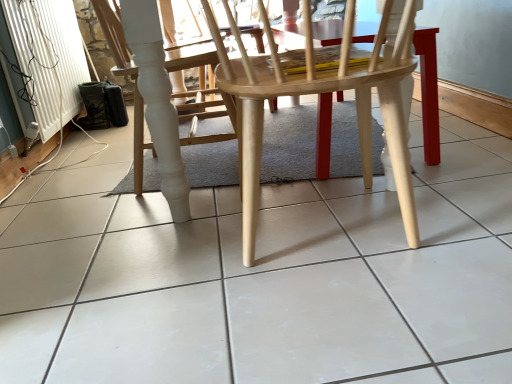
Where is `free space behind natural wood chair at center, the first chair viewed from the front`? free space behind natural wood chair at center, the first chair viewed from the front is located at coordinates (313, 166).